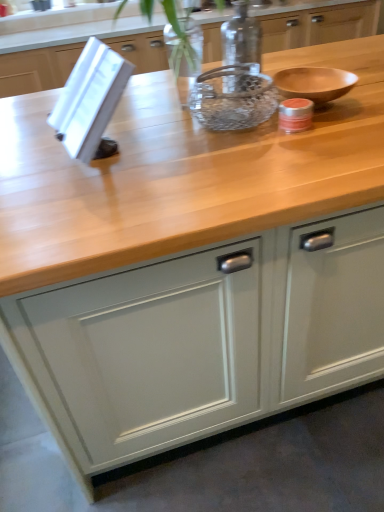
The width and height of the screenshot is (384, 512). What do you see at coordinates (233, 97) in the screenshot?
I see `clear glass bowl at center` at bounding box center [233, 97].

I want to click on matte gray cabinet at center, so click(202, 338).

How many degrees apart are the facing directions of matte gray cabinet at center and clear glass jar at center?

0.104 degrees.

Which of these two, matte gray cabinet at center or clear glass jar at center, is smaller?

clear glass jar at center is smaller.

Consider the image. From the image's perspective, relative to clear glass jar at center, is matte gray cabinet at center above or below?

Clearly, from the image's perspective, matte gray cabinet at center is below clear glass jar at center.

Is matte gray cabinet at center directly adjacent to clear glass jar at center?

There is a gap between matte gray cabinet at center and clear glass jar at center.

Between clear glass jar at center and matte gray cabinet at center, which one appears on the right side from the viewer's perspective?

matte gray cabinet at center is more to the right.

Is clear glass jar at center far from matte gray cabinet at center?

No, clear glass jar at center is not far from matte gray cabinet at center.

Between clear glass jar at center and matte gray cabinet at center, which one has smaller width?

clear glass jar at center.

Which is behind, point (226, 24) or point (135, 371)?

Positioned behind is point (226, 24).

From the image's perspective, is clear glass bowl at center positioned above or below matte gray cabinet at center?

Clearly, from the image's perspective, clear glass bowl at center is above matte gray cabinet at center.

From a real-world perspective, is clear glass bowl at center physically located above or below matte gray cabinet at center?

Clearly, from a real-world perspective, clear glass bowl at center is above matte gray cabinet at center.

Would you consider clear glass bowl at center to be distant from matte gray cabinet at center?

Actually, clear glass bowl at center and matte gray cabinet at center are a little close together.

Is matte gray cabinet at center bigger or smaller than clear glass bowl at center?

Clearly, matte gray cabinet at center is larger in size than clear glass bowl at center.

Identify the location of bowl that appears on the left of matte gray cabinet at center. (233, 97).

Considering their positions, is matte gray cabinet at center located in front of or behind clear glass bowl at center?

In the image, matte gray cabinet at center appears in front of clear glass bowl at center.

Consider the image. Is clear glass jar at center oriented away from clear glass bowl at center?

No, clear glass bowl at center is not at the back of clear glass jar at center.

At what (x,y) coordinates should I click in order to perform the action: click on bowl lying in front of the clear glass jar at center. Please return your answer as a coordinate pair (x, y). The height and width of the screenshot is (512, 384). Looking at the image, I should click on (233, 97).

Between clear glass jar at center and clear glass bowl at center, which one appears on the right side from the viewer's perspective?

clear glass jar at center is more to the right.

Would you consider clear glass jar at center to be distant from clear glass bowl at center?

That's not correct — clear glass jar at center is a little close to clear glass bowl at center.

Is clear glass bowl at center further to the viewer compared to clear glass jar at center?

No, it is not.

From a real-world perspective, relative to clear glass jar at center, is clear glass bowl at center vertically above or below?

clear glass bowl at center is below clear glass jar at center.

Which point is more distant from viewer, [239,128] or [231,88]?

The point [231,88] is farther from the camera.

In the scene shown: Are clear glass bowl at center and clear glass jar at center beside each other?

Yes, clear glass bowl at center and clear glass jar at center clearly make contact.

The image size is (384, 512). What are the coordinates of `cabinetry in front of the clear glass jar at center` in the screenshot? It's located at (202, 338).

Where is `cabinetry on the right of clear glass jar at center`? cabinetry on the right of clear glass jar at center is located at coordinates (202, 338).

Looking at the image, which one is located further to clear glass bowl at center, clear glass jar at center or matte gray cabinet at center?

Result: matte gray cabinet at center is further to clear glass bowl at center.

Which object lies further to the anchor point clear glass bowl at center, matte gray cabinet at center or clear glass jar at center?

matte gray cabinet at center lies further to clear glass bowl at center than the other object.

From the image, which object appears to be nearer to matte gray cabinet at center, clear glass jar at center or clear glass bowl at center?

clear glass bowl at center.

When comparing their distances from clear glass jar at center, does clear glass bowl at center or matte gray cabinet at center seem further?

matte gray cabinet at center is positioned further to the anchor clear glass jar at center.

Based on their spatial positions, is matte gray cabinet at center or clear glass bowl at center closer to clear glass jar at center?

clear glass bowl at center.

Looking at the image, which one is located closer to matte gray cabinet at center, clear glass bowl at center or clear glass jar at center?

clear glass bowl at center lies closer to matte gray cabinet at center than the other object.

I want to click on bowl between matte gray cabinet at center and clear glass jar at center along the z-axis, so click(x=233, y=97).